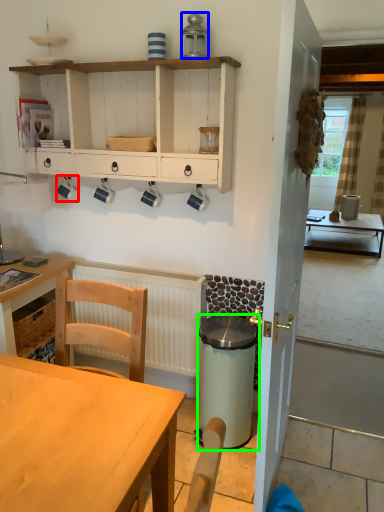
Question: Based on their relative distances, which object is farther from coffee cup (highlighted by a red box)? Choose from appliance (highlighted by a blue box) and trash bin/can (highlighted by a green box).

Choices:
 (A) appliance
 (B) trash bin/can

Answer: (B)